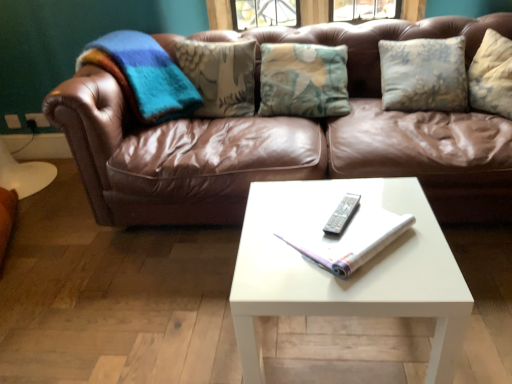
You are a GUI agent. You are given a task and a screenshot of the screen. Output one action in this format:
    pyautogui.click(x=<x>, y=<y>)
    Task: Click on the free spot to the left of white paper book at center
    
    Given the screenshot: What is the action you would take?
    pyautogui.click(x=266, y=243)